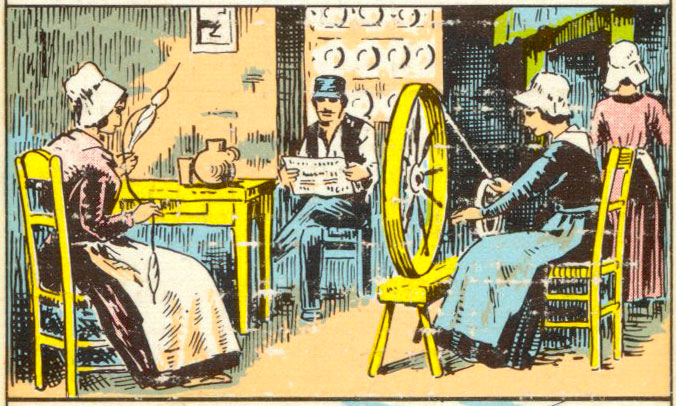
Locate an element on the screen. The image size is (676, 406). cup is located at coordinates (182, 170).